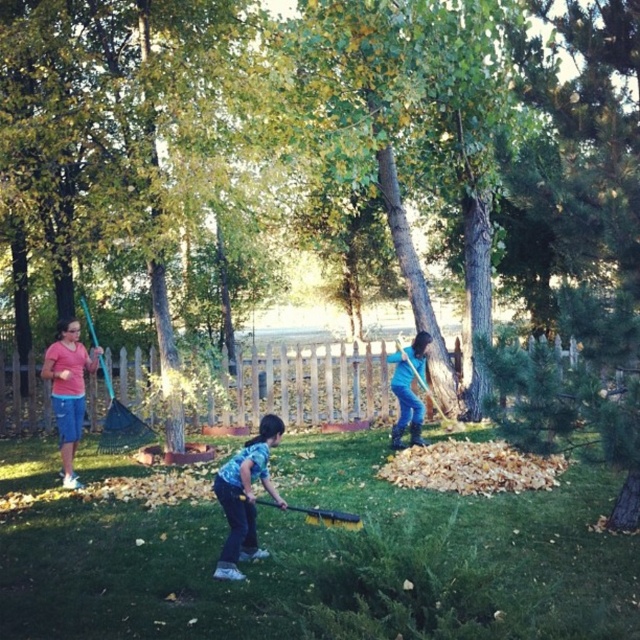
Question: Which point is farther to the camera?

Choices:
 (A) (419, 384)
 (B) (124, 420)
 (C) (81, 362)

Answer: (A)

Question: Considering the real-world distances, which object is farthest from the blue plastic shovel at left?

Choices:
 (A) matte pink shirt at left
 (B) wooden shovel at right

Answer: (B)

Question: Is blue jeans at center further to the viewer compared to yellow plastic brush at lower center?

Choices:
 (A) no
 (B) yes

Answer: (B)

Question: In this image, where is matte pink shirt at left located relative to wooden shovel at right?

Choices:
 (A) left
 (B) right

Answer: (A)

Question: Is yellow plastic brush at lower center thinner than wooden shovel at right?

Choices:
 (A) no
 (B) yes

Answer: (B)

Question: Which object is closer to the camera taking this photo?

Choices:
 (A) green grass at center
 (B) yellow plastic brush at lower center

Answer: (B)